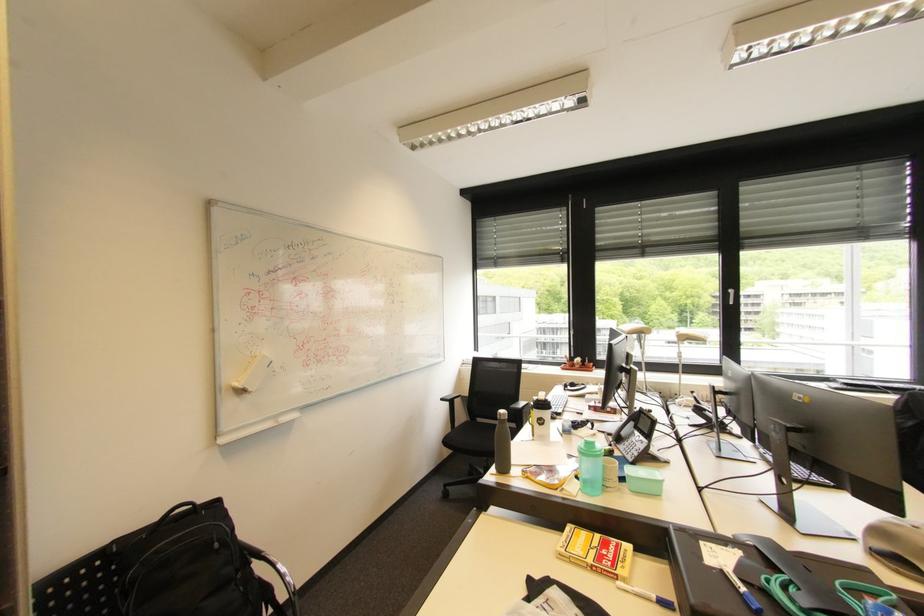
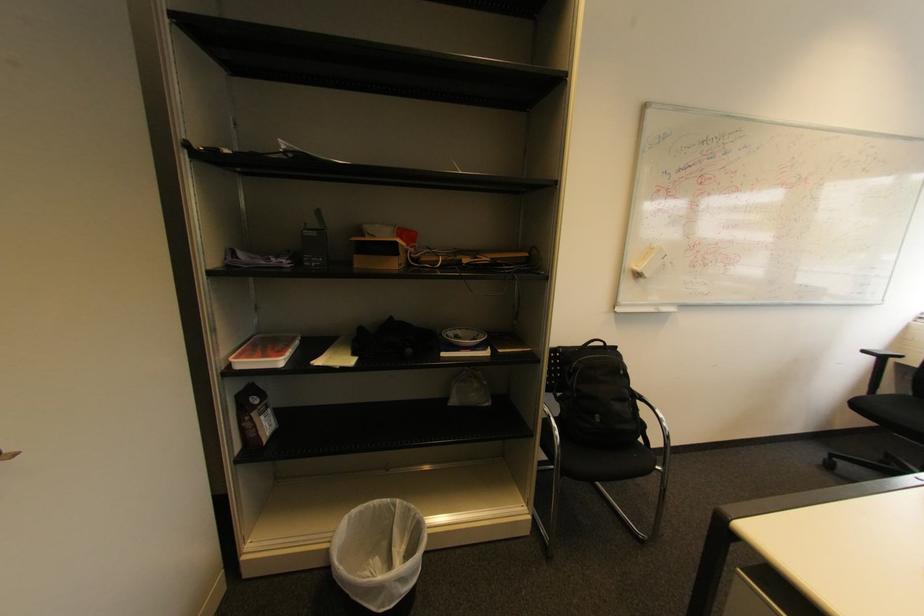
Question: The camera is either moving clockwise (left) or counter-clockwise (right) around the object. The first image is from the beginning of the video and the second image is from the end. Is the camera moving left or right when shooting the video?

Choices:
 (A) Left
 (B) Right

Answer: (B)